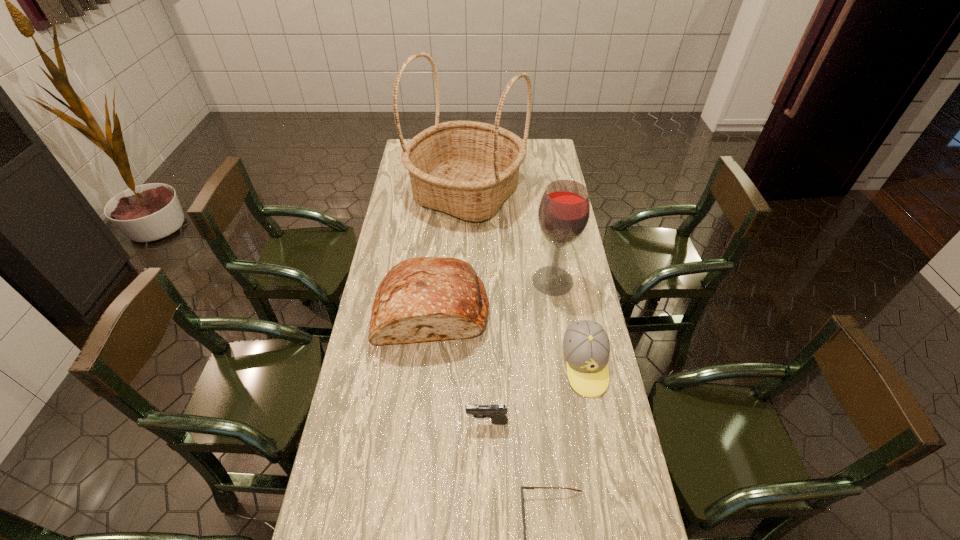
Select which object is the closest to the fourth shortest object. Please provide its 2D coordinates. Your answer should be formatted as a tuple, i.e. [(x, y)], where the tuple contains the x and y coordinates of a point satisfying the conditions above.

[(564, 210)]

The height and width of the screenshot is (540, 960). Find the location of `the third closest object to the second shortest object`. the third closest object to the second shortest object is located at coordinates (421, 299).

Locate an element on the screen. vacant area that satisfies the following two spatial constraints: 1. on the front-facing side of the fourth tallest object; 2. at the barrel of the second shortest object is located at coordinates (595, 422).